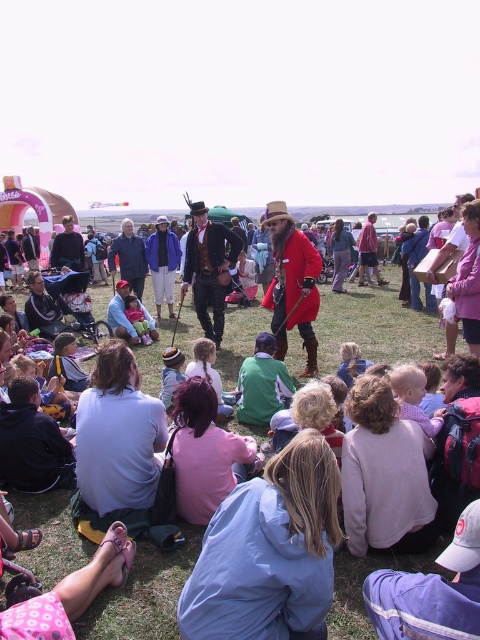
Question: Can you confirm if red velvet coat at center is positioned above blue fabric jacket at lower center?

Choices:
 (A) no
 (B) yes

Answer: (B)

Question: Where is red velvet coat at center located in relation to white cotton shirt at lower left in the image?

Choices:
 (A) below
 (B) above

Answer: (A)

Question: Which point is closer to the camera taking this photo?

Choices:
 (A) (226, 556)
 (B) (325, 540)

Answer: (A)

Question: Is red velvet coat at center positioned at the back of blue fabric jacket at lower center?

Choices:
 (A) no
 (B) yes

Answer: (A)

Question: Which point is closer to the camera taking this photo?

Choices:
 (A) (233, 516)
 (B) (151, 456)

Answer: (A)

Question: Which object is positioned farthest from the white cotton shirt at lower left?

Choices:
 (A) blue fabric jacket at lower center
 (B) red velvet coat at center

Answer: (A)